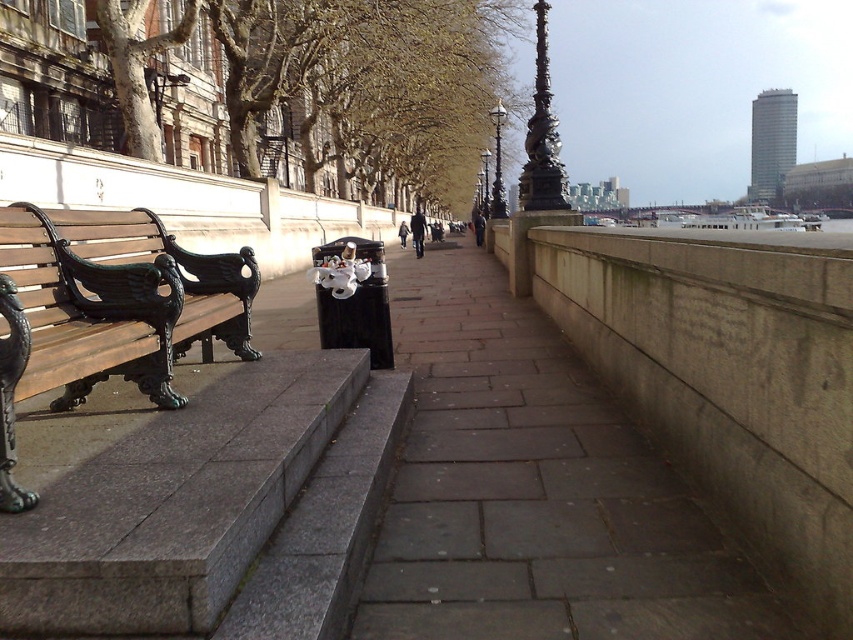
You are standing at the point marked as point (535, 492) in the image. What type of surface are you currently standing on?

You are standing on the gray concrete sidewalk at center.

You are a delivery person trying to place a large package on the gray concrete sidewalk at center and the matte brown bench at left. Which surface can accommodate the package without it hanging over the edges?

The matte brown bench at left can accommodate the package without it hanging over the edges because it is larger than the gray concrete sidewalk at center.

Consider the image. You are a delivery person with a cart that is 1.2 meters wide. You need to move along the gray concrete sidewalk at center and pass by the matte brown bench at left. Can your cart fit on the sidewalk?

The gray concrete sidewalk at center might be wider than matte brown bench at left, so it is possible that the sidewalk is wide enough for the cart. However, since the exact width isn t specified, there s uncertainty. If the sidewalk is indeed wider than the bench, then it should accommodate the 1.2 meter cart.